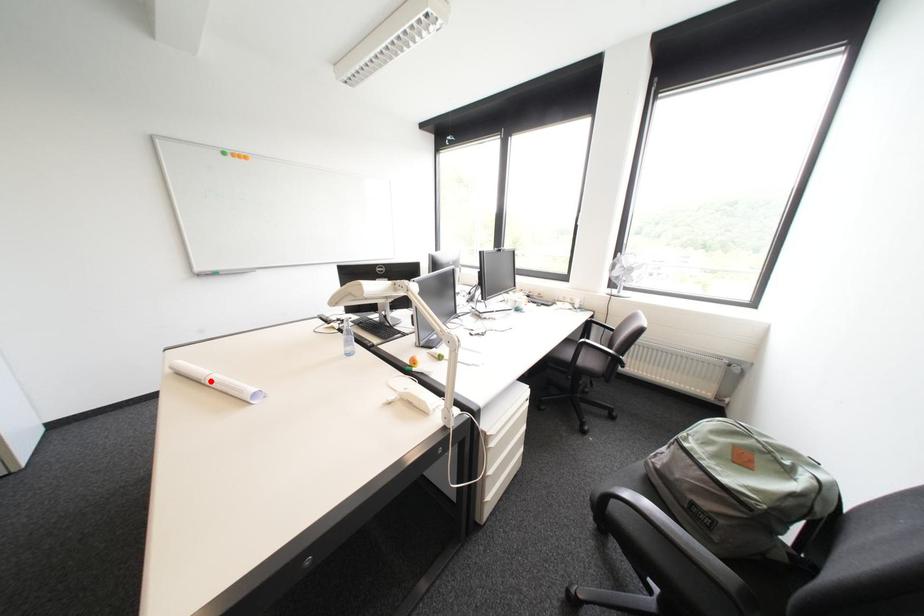
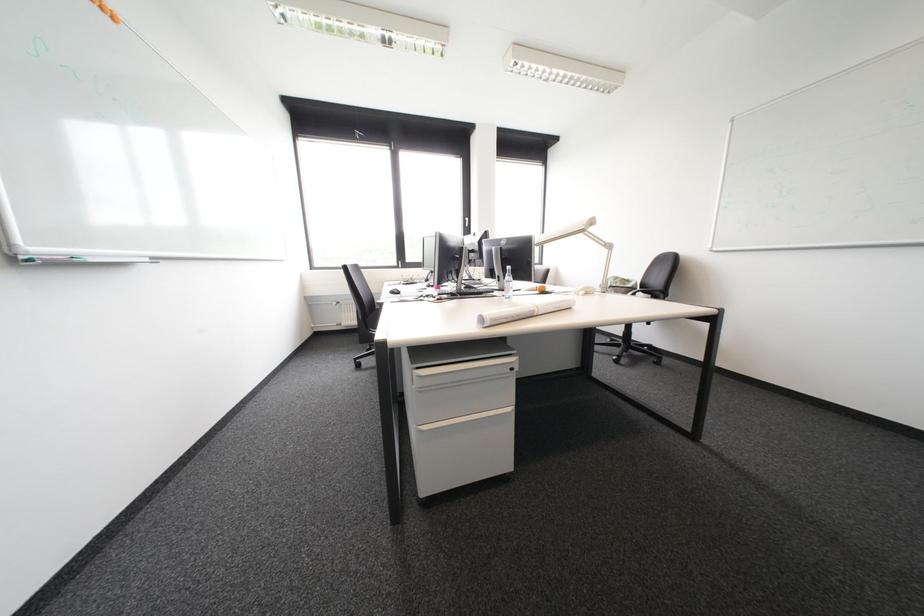
Question: I am providing you with two images of the same scene from different viewpoints. A red point is marked on the first image. Is the red point's position out of view in image 2?

Choices:
 (A) Yes
 (B) No

Answer: (B)